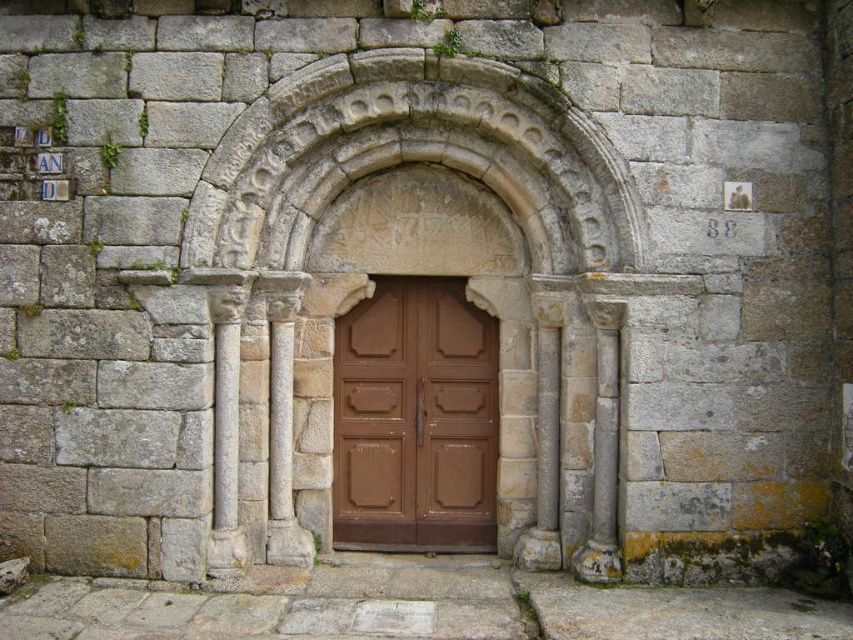
Is carved stone arch at center closer to the viewer compared to brown matte door at center?

Yes, carved stone arch at center is closer to the viewer.

Which is below, carved stone arch at center or brown matte door at center?

brown matte door at center is below.

Between point (279, 124) and point (482, 378), which one is positioned behind?

Point (482, 378)

Where is `carved stone arch at center`? This screenshot has height=640, width=853. carved stone arch at center is located at coordinates (410, 154).